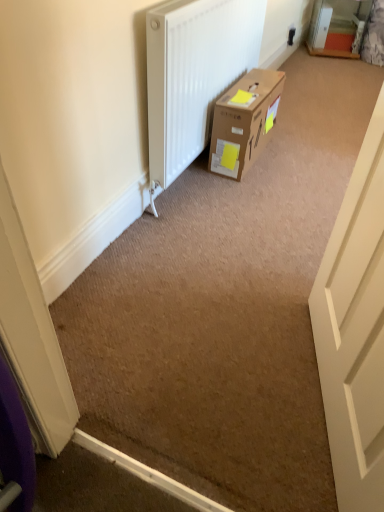
The image size is (384, 512). Identify the location of vacant area that lies between white matte door at right and brown cardboard box at center. (264, 220).